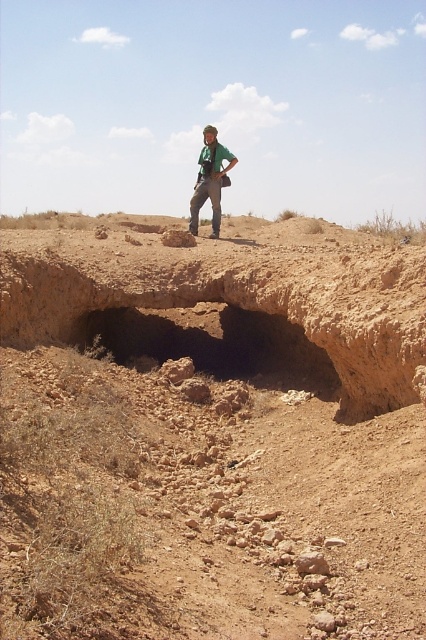
Which is behind, point (172, 253) or point (224, 353)?

The point (224, 353) is more distant.

Does dusty brown dirt field at center appear on the left side of dusty soil cave at center?

No, dusty brown dirt field at center is not to the left of dusty soil cave at center.

This screenshot has width=426, height=640. What do you see at coordinates (210, 433) in the screenshot? I see `dusty brown dirt field at center` at bounding box center [210, 433].

You are a GUI agent. You are given a task and a screenshot of the screen. Output one action in this format:
    pyautogui.click(x=<x>, y=<y>)
    Task: Click on the dusty brown dirt field at center
    The width and height of the screenshot is (426, 640).
    Given the screenshot: What is the action you would take?
    pyautogui.click(x=210, y=433)

Measure the distance from dusty brown dirt field at center to green fabric shirt at center.

They are 4.31 meters apart.

Which is below, dusty brown dirt field at center or green fabric shirt at center?

dusty brown dirt field at center

Measure the distance between dusty brown dirt field at center and camera.

dusty brown dirt field at center and camera are 11.72 feet apart.

Locate an element on the screen. dusty brown dirt field at center is located at coordinates (210, 433).

Is the position of dusty soil cave at center less distant than that of green fabric shirt at center?

Yes, dusty soil cave at center is in front of green fabric shirt at center.

Who is shorter, dusty soil cave at center or green fabric shirt at center?

dusty soil cave at center

Is point (301, 369) behind point (213, 156)?

No, (301, 369) is in front of (213, 156).

The height and width of the screenshot is (640, 426). Identify the location of dusty soil cave at center. (215, 344).